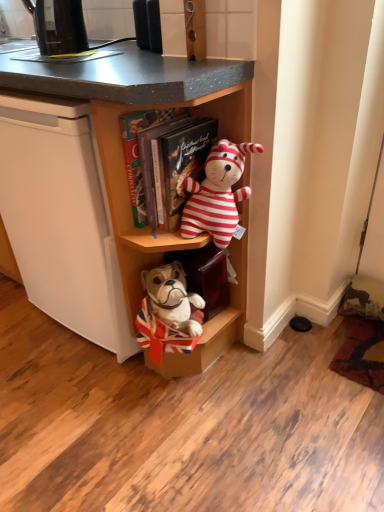
This screenshot has width=384, height=512. What are the coordinates of `blank area beneath striped plush toy at center (from a real-world perspective)` in the screenshot? It's located at (239, 367).